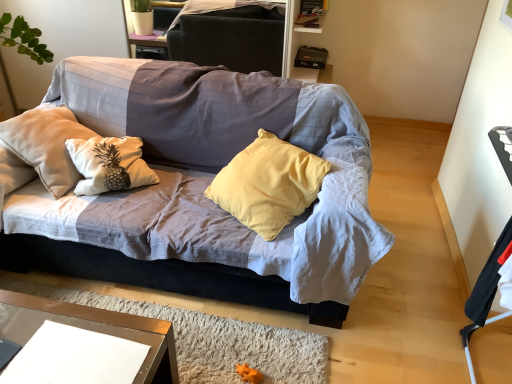
Question: From the image's perspective, is textured fabric couch at center over clear glass table at lower left?

Choices:
 (A) no
 (B) yes

Answer: (B)

Question: From a real-world perspective, is textured fabric couch at center under clear glass table at lower left?

Choices:
 (A) no
 (B) yes

Answer: (A)

Question: Is textured fabric couch at center looking in the opposite direction of clear glass table at lower left?

Choices:
 (A) no
 (B) yes

Answer: (A)

Question: Is textured fabric couch at center at the right side of clear glass table at lower left?

Choices:
 (A) yes
 (B) no

Answer: (A)

Question: From a real-world perspective, is textured fabric couch at center located higher than clear glass table at lower left?

Choices:
 (A) yes
 (B) no

Answer: (A)

Question: From the image's perspective, is textured fabric couch at center above or below dark gray fabric dresser at upper center?

Choices:
 (A) below
 (B) above

Answer: (A)

Question: Considering the relative positions of textured fabric couch at center and dark gray fabric dresser at upper center in the image provided, is textured fabric couch at center to the left or to the right of dark gray fabric dresser at upper center?

Choices:
 (A) left
 (B) right

Answer: (B)

Question: From their relative heights in the image, would you say textured fabric couch at center is taller or shorter than dark gray fabric dresser at upper center?

Choices:
 (A) tall
 (B) short

Answer: (A)

Question: Is textured fabric couch at center in front of or behind dark gray fabric dresser at upper center in the image?

Choices:
 (A) behind
 (B) front

Answer: (B)

Question: Relative to black fabric armchair at right, is dark gray fabric dresser at upper center in front or behind?

Choices:
 (A) front
 (B) behind

Answer: (B)

Question: Is point (267, 1) positioned closer to the camera than point (505, 145)?

Choices:
 (A) closer
 (B) farther

Answer: (B)

Question: Would you say dark gray fabric dresser at upper center is inside or outside black fabric armchair at right?

Choices:
 (A) outside
 (B) inside

Answer: (A)

Question: In terms of width, does dark gray fabric dresser at upper center look wider or thinner when compared to black fabric armchair at right?

Choices:
 (A) thin
 (B) wide

Answer: (A)

Question: In terms of width, does textured fabric couch at center look wider or thinner when compared to clear glass table at lower left?

Choices:
 (A) wide
 (B) thin

Answer: (A)

Question: Looking at the image, does textured fabric couch at center seem bigger or smaller compared to clear glass table at lower left?

Choices:
 (A) big
 (B) small

Answer: (A)